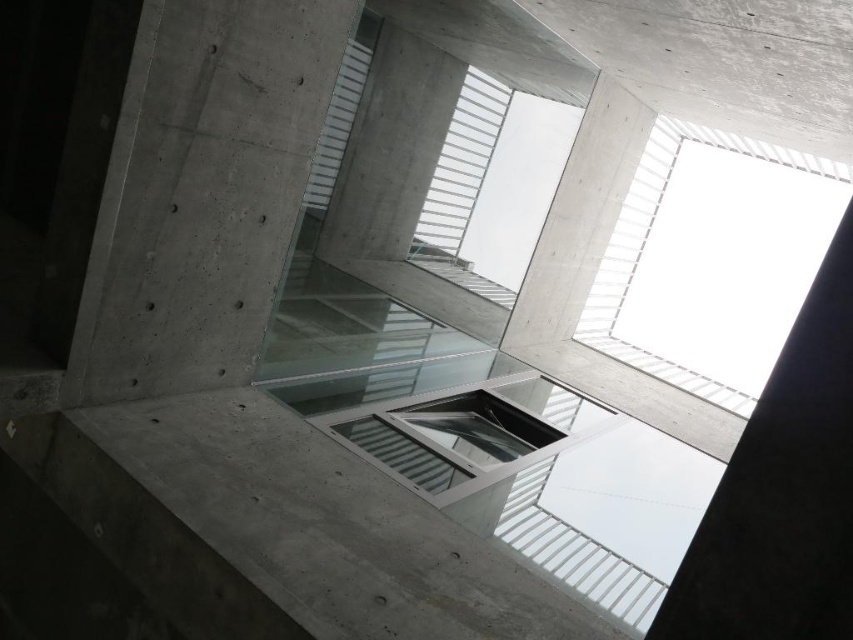
Does point (291, 3) come behind point (614, 236)?

No, it is in front of (614, 236).

Who is more distant from viewer, (265, 230) or (612, 236)?

Positioned behind is point (612, 236).

Where is `concrete at left`? The width and height of the screenshot is (853, 640). concrete at left is located at coordinates pos(206,195).